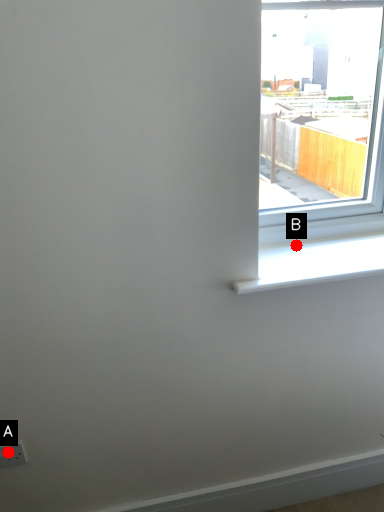
Question: Two points are circled on the image, labeled by A and B beside each circle. Which point is closer to the camera taking this photo?

Choices:
 (A) A is closer
 (B) B is closer

Answer: (A)